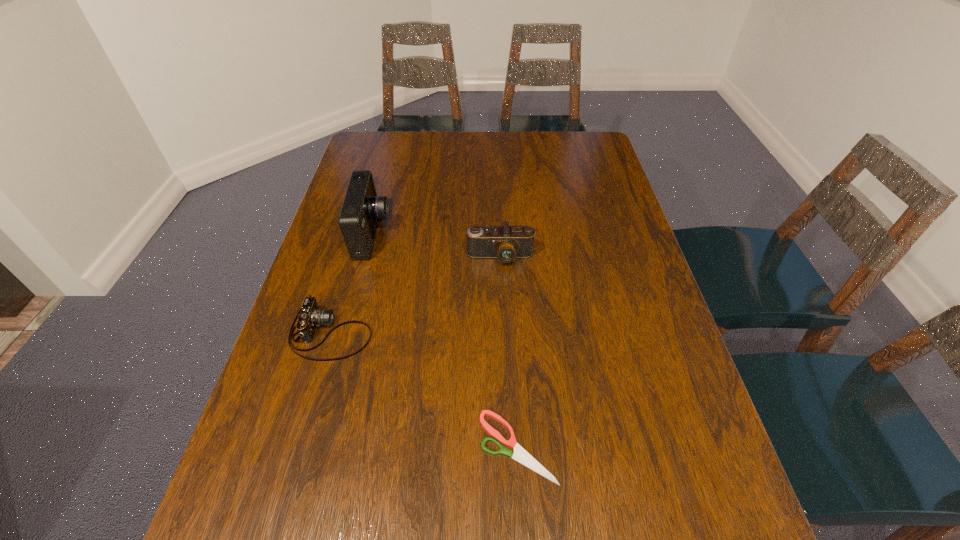
I want to click on the tallest camera, so click(x=361, y=209).

Locate an element on the screen. This screenshot has width=960, height=540. the third shortest object is located at coordinates (506, 243).

At what (x,y) coordinates should I click in order to perform the action: click on the rightmost camera. Please return your answer as a coordinate pair (x, y). Looking at the image, I should click on (506, 243).

Identify the location of the third tallest object. (309, 316).

Where is `the third farthest object`? This screenshot has width=960, height=540. the third farthest object is located at coordinates [309, 316].

Locate an element on the screen. The height and width of the screenshot is (540, 960). the shortest object is located at coordinates (520, 454).

Find the location of a particular element. Image resolution: width=960 pixels, height=540 pixels. the nearest object is located at coordinates (520, 454).

What are the coordinates of `free region located on the front-facing side of the tallest camera` in the screenshot? It's located at (448, 235).

This screenshot has height=540, width=960. Find the location of `vacant space located on the lens of the rightmost camera`. vacant space located on the lens of the rightmost camera is located at coordinates (504, 342).

Identify the location of free location located on the front-facing side of the third farthest object. The width and height of the screenshot is (960, 540). (411, 333).